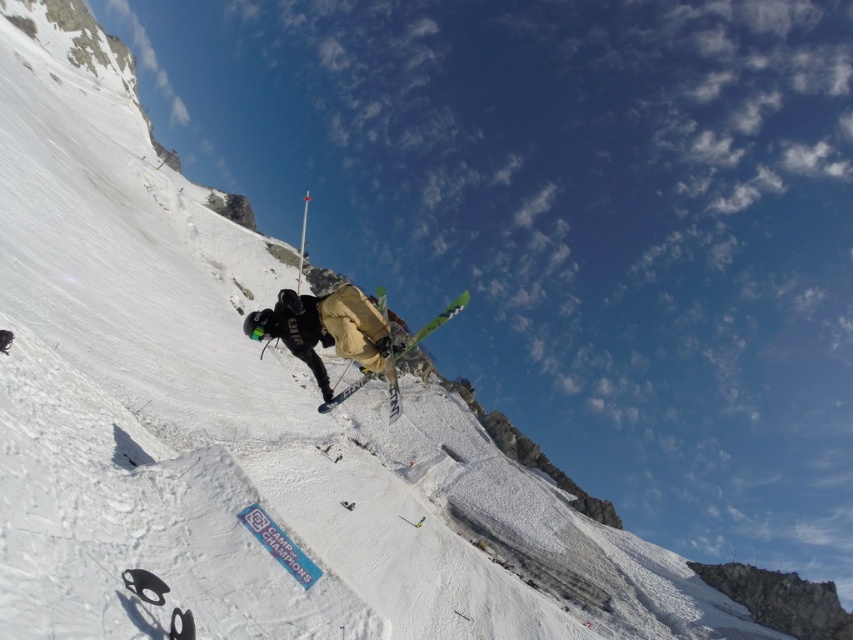
You are a photographer positioned at the bottom of the slope. You want to capture a photo of the skier so that the matte khaki ski suit at center and the green metallic skis at center appear in the same frame. Based on their positions, which object should you focus on first to ensure both are in the frame?

The matte khaki ski suit at center is to the left of green metallic skis at center. Since the skier is midair, focusing on the position of the skis first would help frame the entire body, including the suit, as the suit is positioned to the left of the skis.

You are a photographer capturing the skier midair. You need to focus your camera on the matte khaki ski suit at center and the green metallic skis at center. Which object should you adjust your focus to first if you want to capture both in sharp detail?

The matte khaki ski suit at center is in front of the green metallic skis at center, so you should focus on the matte khaki ski suit at center first to ensure both are in sharp detail.